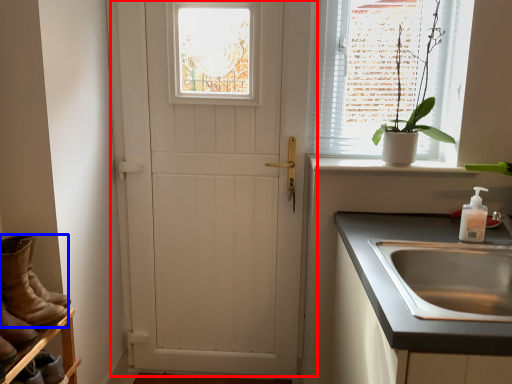
Question: Which of the following is the closest to the observer, door (highlighted by a red box) or footwear (highlighted by a blue box)?

Choices:
 (A) door
 (B) footwear

Answer: (B)